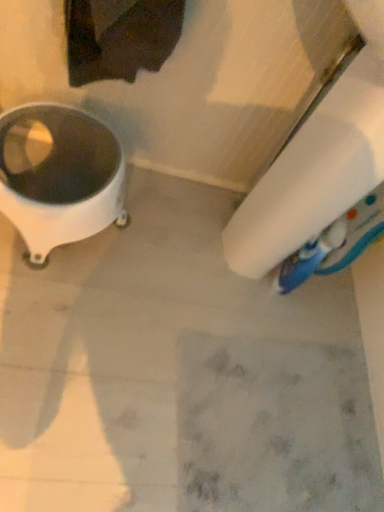
Question: Is white glossy toilet paper at lower right in front of or behind white glossy waste container at left in the image?

Choices:
 (A) behind
 (B) front

Answer: (B)

Question: In terms of width, does white glossy toilet paper at lower right look wider or thinner when compared to white glossy waste container at left?

Choices:
 (A) wide
 (B) thin

Answer: (A)

Question: Is point (342, 186) positioned closer to the camera than point (56, 229)?

Choices:
 (A) closer
 (B) farther

Answer: (A)

Question: Considering the relative positions of white glossy waste container at left and white glossy toilet paper at lower right in the image provided, is white glossy waste container at left to the left or to the right of white glossy toilet paper at lower right?

Choices:
 (A) right
 (B) left

Answer: (B)

Question: Based on their sizes in the image, would you say white glossy waste container at left is bigger or smaller than white glossy toilet paper at lower right?

Choices:
 (A) small
 (B) big

Answer: (A)

Question: From the image's perspective, relative to white glossy toilet paper at lower right, is white glossy waste container at left above or below?

Choices:
 (A) above
 (B) below

Answer: (B)

Question: From their relative heights in the image, would you say white glossy waste container at left is taller or shorter than white glossy toilet paper at lower right?

Choices:
 (A) tall
 (B) short

Answer: (B)